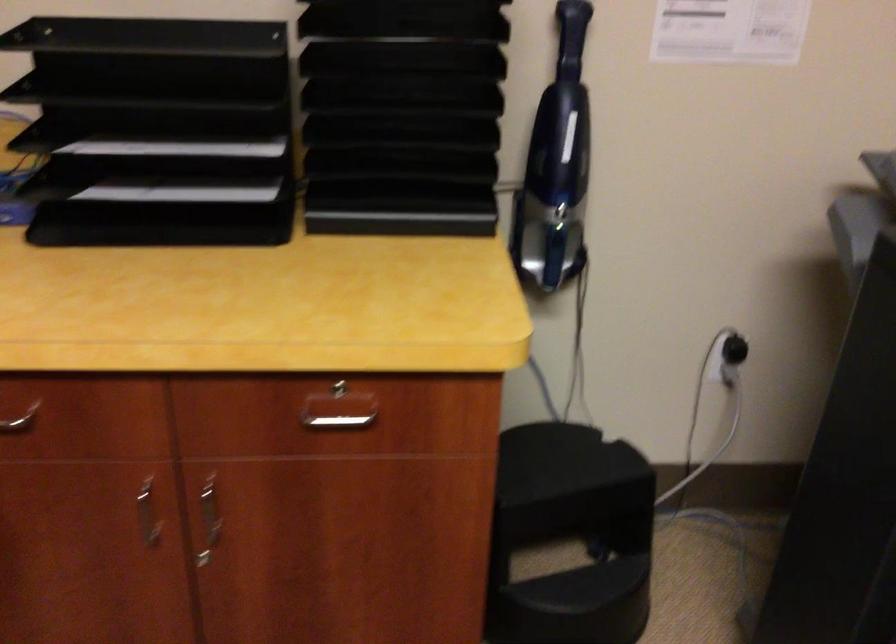
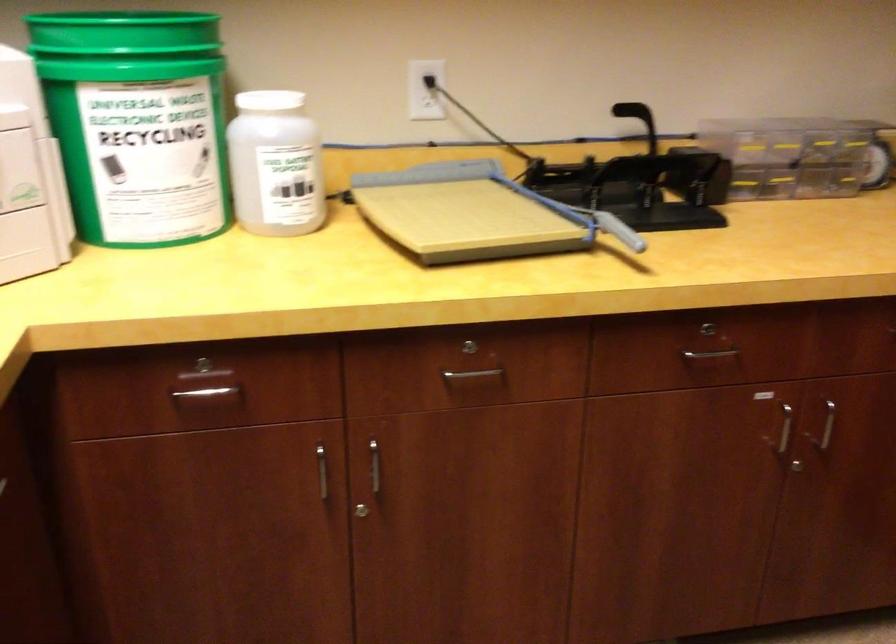
Consider the image. First-person continuous shooting, in which direction is the camera rotating?

The camera's rotation is toward left-down.